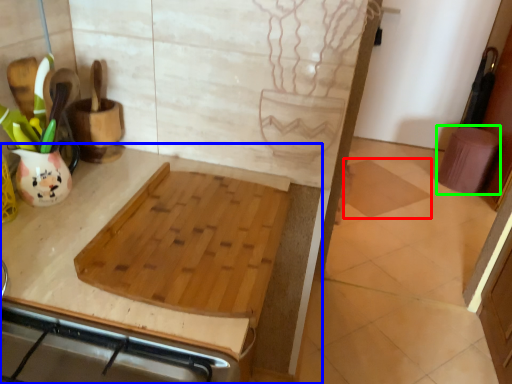
Question: Based on their relative distances, which object is nearer to tile (highlighted by a red box)? Choose from countertop (highlighted by a blue box) and step stool (highlighted by a green box).

Choices:
 (A) countertop
 (B) step stool

Answer: (B)